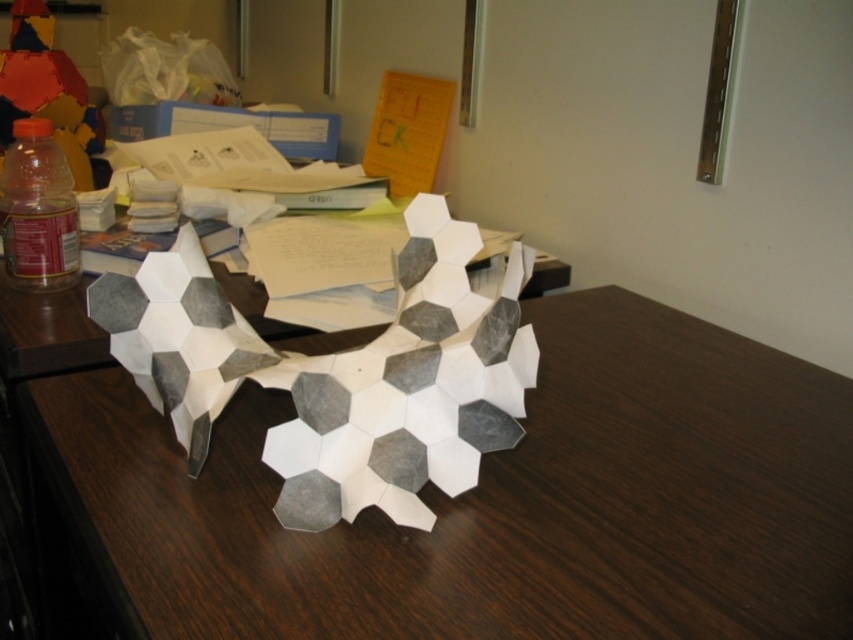
Question: Among these points, which one is nearest to the camera?

Choices:
 (A) (10, 204)
 (B) (741, 420)

Answer: (B)

Question: Can you confirm if white wood table at center is wider than translucent plastic bottle at left?

Choices:
 (A) no
 (B) yes

Answer: (B)

Question: Is white wood table at center smaller than translucent plastic bottle at left?

Choices:
 (A) yes
 (B) no

Answer: (B)

Question: Among these objects, which one is farthest from the camera?

Choices:
 (A) white wood table at center
 (B) translucent plastic bottle at left

Answer: (B)

Question: Is white wood table at center to the right of translucent plastic bottle at left from the viewer's perspective?

Choices:
 (A) yes
 (B) no

Answer: (A)